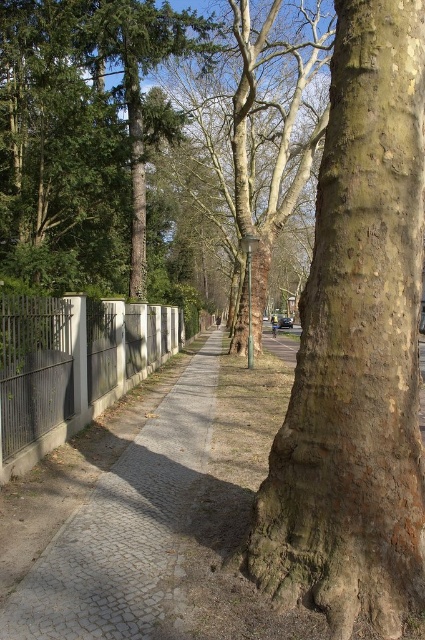
Question: Which is nearer to the white concrete fence at left?

Choices:
 (A) smooth bark tree at center
 (B) green matte tree at upper left
 (C) gray cobblestone pavement at center
 (D) brown rough bark tree trunk at right

Answer: (C)

Question: Which of these objects is positioned closest to the green matte tree at upper left?

Choices:
 (A) smooth bark tree at center
 (B) gray cobblestone pavement at center
 (C) white concrete fence at left

Answer: (C)

Question: Which point is farther to the camera?

Choices:
 (A) gray cobblestone pavement at center
 (B) brown rough bark tree trunk at right

Answer: (A)

Question: Is smooth bark tree at center thinner than white concrete fence at left?

Choices:
 (A) no
 (B) yes

Answer: (A)

Question: Does brown rough bark tree trunk at right come behind white concrete fence at left?

Choices:
 (A) no
 (B) yes

Answer: (A)

Question: Does green matte tree at upper left lie behind smooth bark tree at center?

Choices:
 (A) no
 (B) yes

Answer: (A)